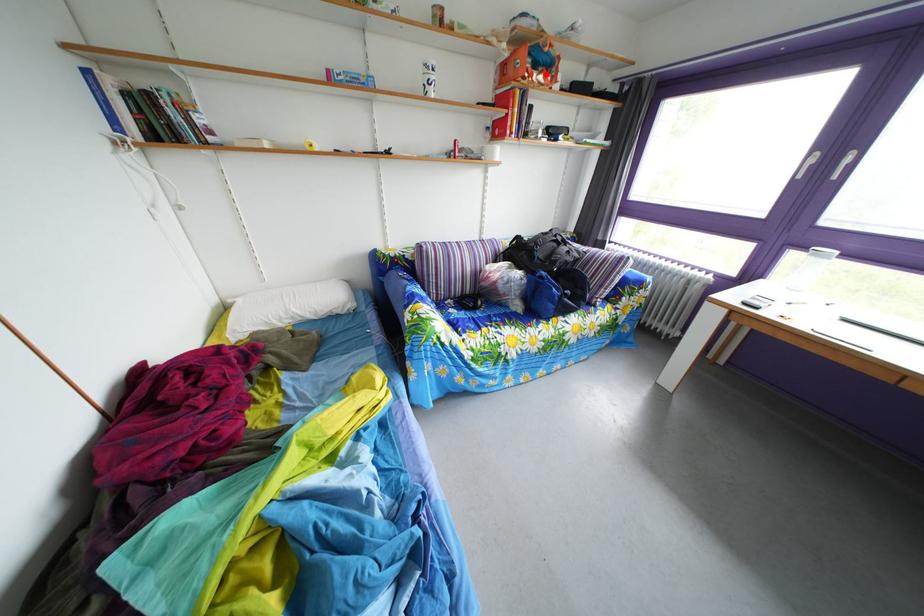
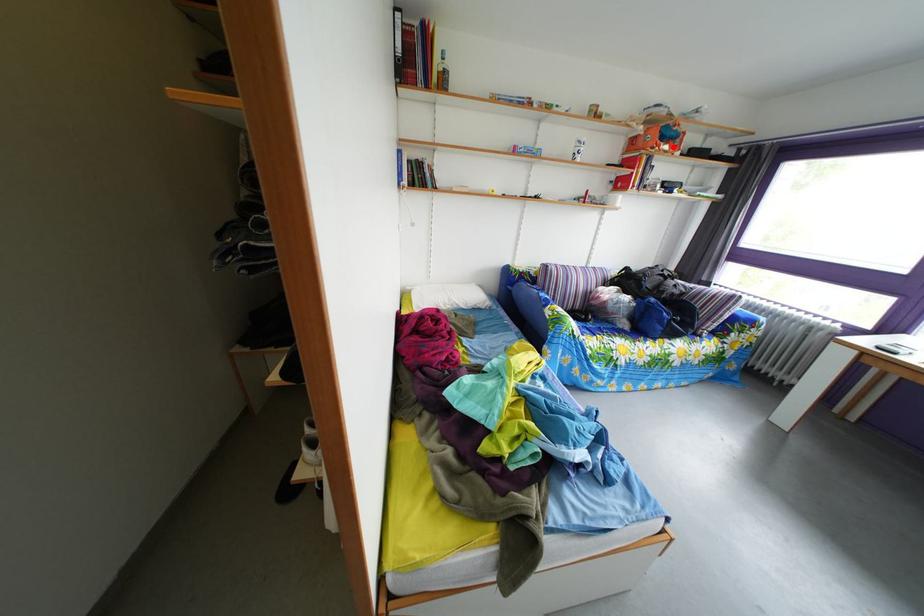
I am providing you with two images of the same scene from different viewpoints. A red point is marked on the first image and another point is marked on the second image. Are the points marked in image1 and image2 representing the same 3D position?

Yes